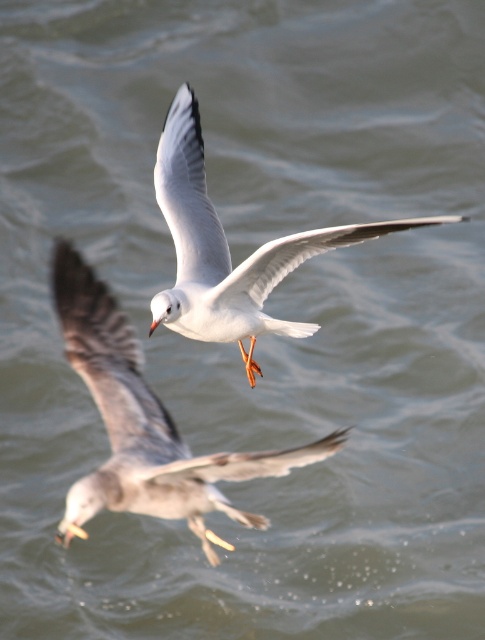
Who is lower down, white feathered bird at center or white matte bird at center?

Positioned lower is white feathered bird at center.

Does white feathered bird at center have a lesser width compared to white matte bird at center?

No.

Where is `white feathered bird at center`? white feathered bird at center is located at coordinates (145, 422).